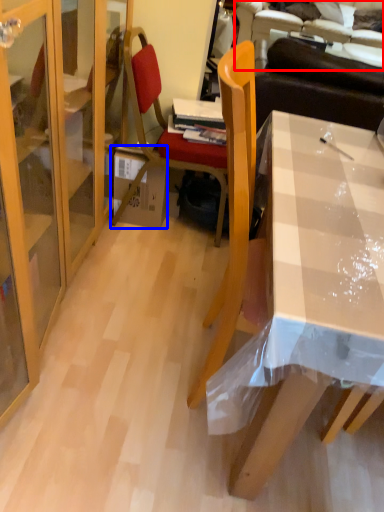
Question: Which object is closer to the camera taking this photo, couch (highlighted by a red box) or box (highlighted by a blue box)?

Choices:
 (A) couch
 (B) box

Answer: (B)